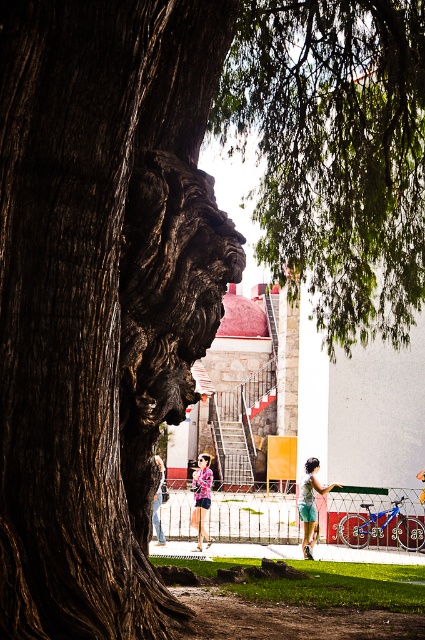
Question: Is dark brown textured bark at left positioned in front of green leafy tree at upper center?

Choices:
 (A) no
 (B) yes

Answer: (B)

Question: Estimate the real-world distances between objects in this image. Which object is farther from the dark brown textured bark at left?

Choices:
 (A) denim shorts at lower center
 (B) brushed metal jacket at center
 (C) pink fabric dress at center

Answer: (C)

Question: Is green leafy tree at upper center closer to camera compared to denim shorts at lower center?

Choices:
 (A) yes
 (B) no

Answer: (A)

Question: Estimate the real-world distances between objects in this image. Which object is farther from the pink fabric dress at center?

Choices:
 (A) dark brown textured bark at left
 (B) green leafy tree at upper center
 (C) brushed metal jacket at center
 (D) denim shorts at lower center

Answer: (A)

Question: Which object is positioned farthest from the denim shorts at lower center?

Choices:
 (A) brushed metal jacket at center
 (B) dark brown textured bark at left
 (C) green leafy tree at upper center

Answer: (B)

Question: In this image, where is pink fabric dress at center located relative to brushed metal jacket at center?

Choices:
 (A) above
 (B) below

Answer: (B)